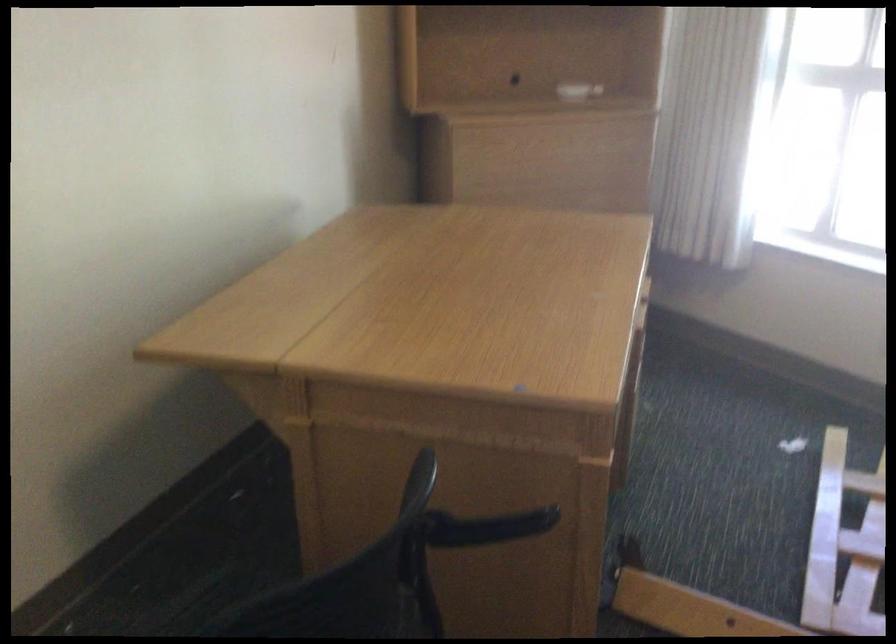
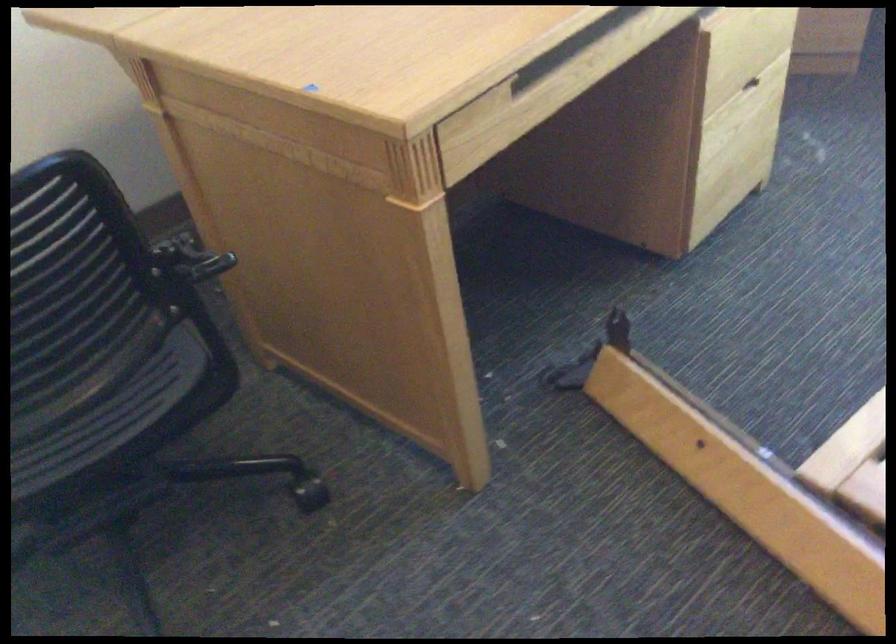
How did the camera likely rotate?

The camera rotated toward left-down.